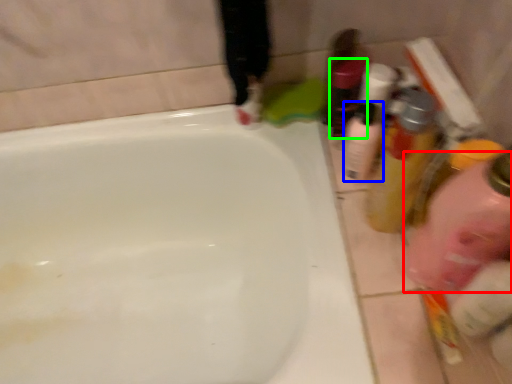
Question: Considering the real-world distances, which object is closest to cleaning product (highlighted by a red box)? mouthwash (highlighted by a blue box) or toiletry (highlighted by a green box).

Choices:
 (A) mouthwash
 (B) toiletry

Answer: (A)